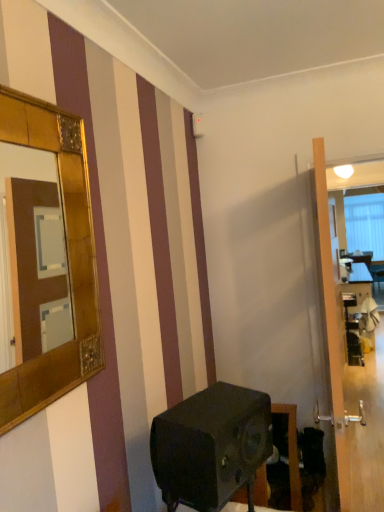
Question: Can you confirm if gold textured mirror at upper left is shorter than matte black speaker at lower center?

Choices:
 (A) no
 (B) yes

Answer: (A)

Question: From the image's perspective, does gold textured mirror at upper left appear lower than matte black speaker at lower center?

Choices:
 (A) yes
 (B) no

Answer: (B)

Question: Does gold textured mirror at upper left have a greater width compared to matte black speaker at lower center?

Choices:
 (A) no
 (B) yes

Answer: (A)

Question: Considering the relative positions of gold textured mirror at upper left and matte black speaker at lower center in the image provided, is gold textured mirror at upper left to the right of matte black speaker at lower center from the viewer's perspective?

Choices:
 (A) no
 (B) yes

Answer: (A)

Question: Considering the relative sizes of gold textured mirror at upper left and matte black speaker at lower center in the image provided, is gold textured mirror at upper left smaller than matte black speaker at lower center?

Choices:
 (A) no
 (B) yes

Answer: (B)

Question: Could you tell me if gold textured mirror at upper left is turned towards matte black speaker at lower center?

Choices:
 (A) yes
 (B) no

Answer: (B)

Question: Considering the relative sizes of transparent glass door at right and matte black speaker at lower center in the image provided, is transparent glass door at right shorter than matte black speaker at lower center?

Choices:
 (A) no
 (B) yes

Answer: (A)

Question: Is transparent glass door at right facing away from matte black speaker at lower center?

Choices:
 (A) yes
 (B) no

Answer: (B)

Question: Does transparent glass door at right have a lesser width compared to matte black speaker at lower center?

Choices:
 (A) no
 (B) yes

Answer: (B)

Question: Does transparent glass door at right appear on the right side of matte black speaker at lower center?

Choices:
 (A) yes
 (B) no

Answer: (A)

Question: Does transparent glass door at right have a greater width compared to matte black speaker at lower center?

Choices:
 (A) no
 (B) yes

Answer: (A)

Question: Considering the relative sizes of transparent glass door at right and matte black speaker at lower center in the image provided, is transparent glass door at right bigger than matte black speaker at lower center?

Choices:
 (A) no
 (B) yes

Answer: (B)

Question: From a real-world perspective, is matte black speaker at lower center located beneath transparent glass door at right?

Choices:
 (A) yes
 (B) no

Answer: (A)